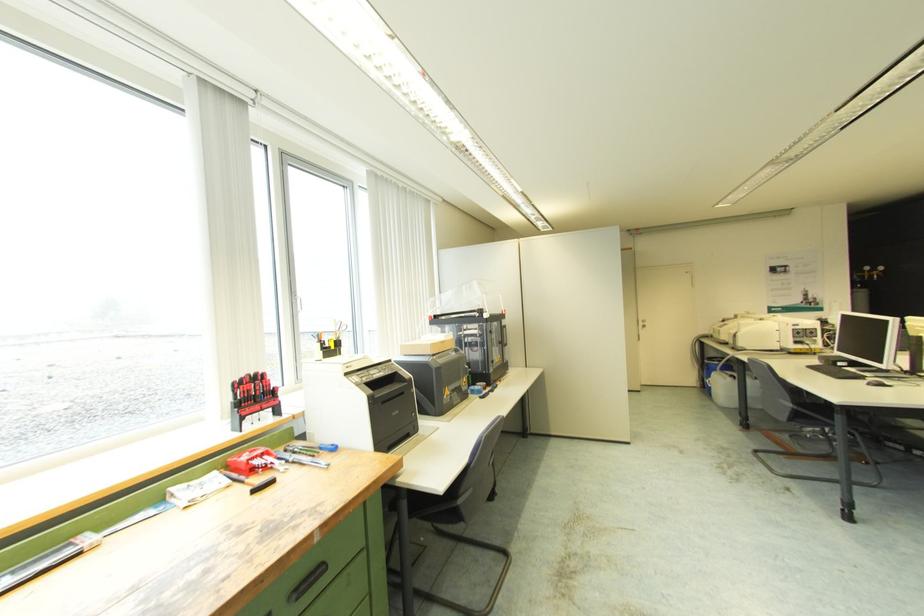
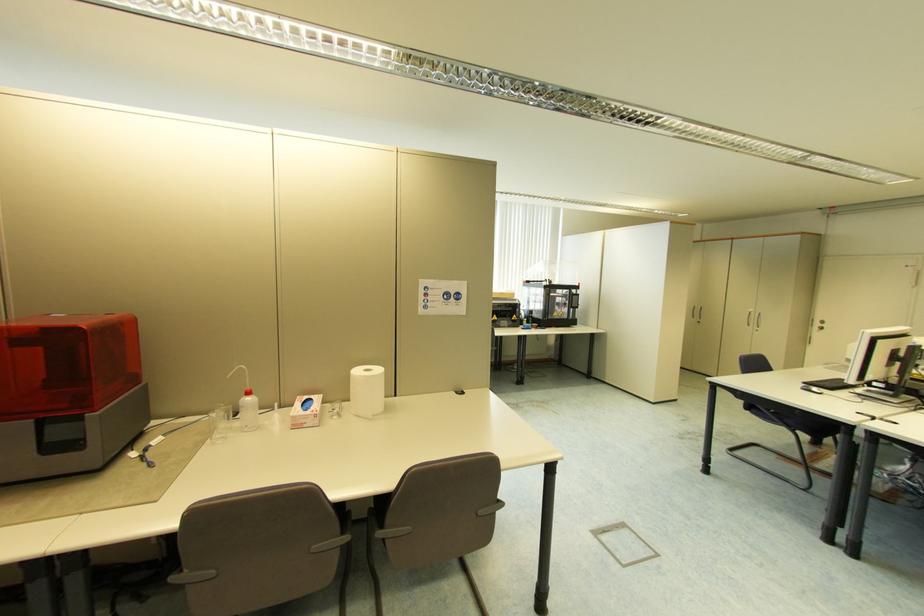
In the second image, find the point that corresponds to point 645,323 in the first image.

(821, 325)